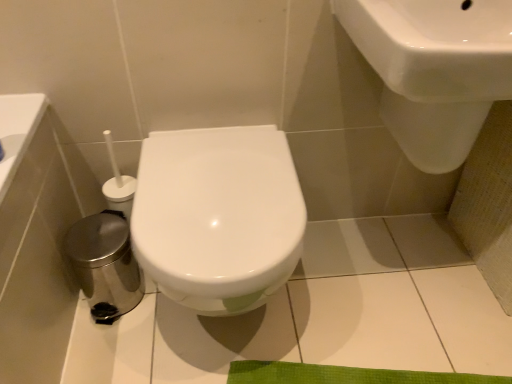
Find the location of a particular element. free spot below white glossy sink at upper right (from a real-world perspective) is located at coordinates (411, 290).